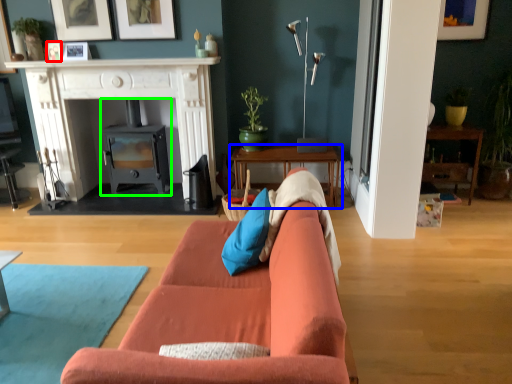
Question: Which is nearer to the picture frame (highlighted by a red box)? table (highlighted by a blue box) or wood burning stove (highlighted by a green box).

Choices:
 (A) table
 (B) wood burning stove

Answer: (B)